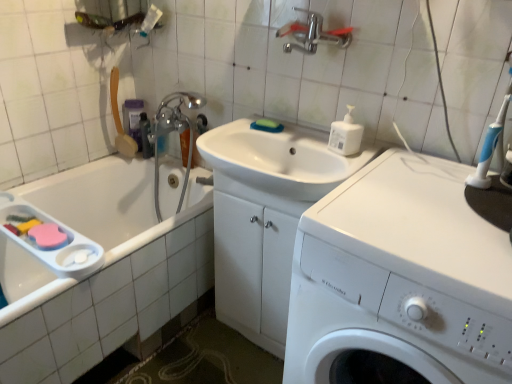
Find the location of a particular element. vacant space behind blue plastic toothbrush at upper right is located at coordinates (441, 163).